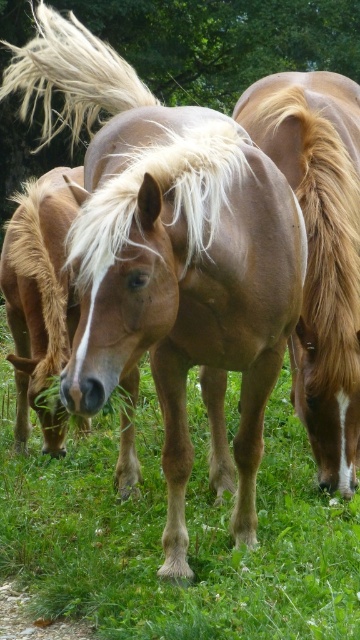
You are a farmer checking the field. You see the light brown glossy horse at center and the white silky mane at center. Which one is wider?

The light brown glossy horse at center is wider than the white silky mane at center.

You are standing in the field and want to approach the brown glossy horse at center. If your walking speed is 1.2 meters per second, how many seconds will it take you to reach the horse?

The distance between you and the brown glossy horse at center is 2.95 meters. At a speed of 1.2 meters per second, it would take approximately 2.46 seconds to reach the horse.